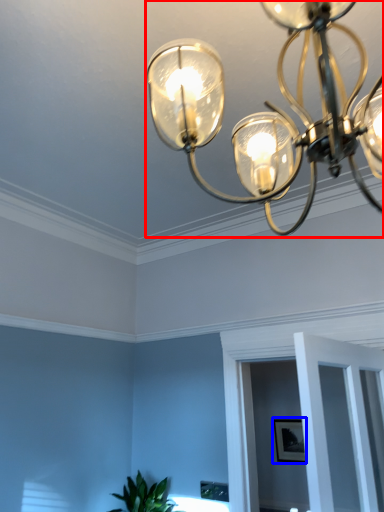
Question: Among these objects, which one is farthest to the camera, lamp (highlighted by a red box) or picture frame (highlighted by a blue box)?

Choices:
 (A) lamp
 (B) picture frame

Answer: (B)